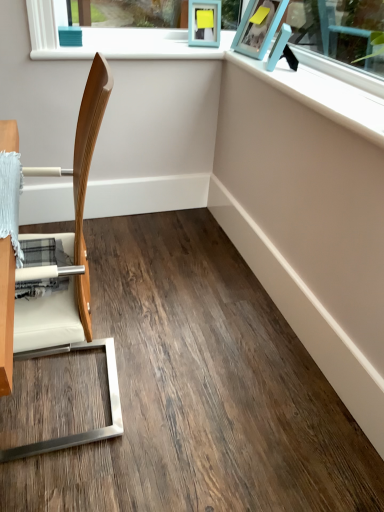
What are the coordinates of `vacant area on the back side of wooden chair at left` in the screenshot? It's located at (137, 318).